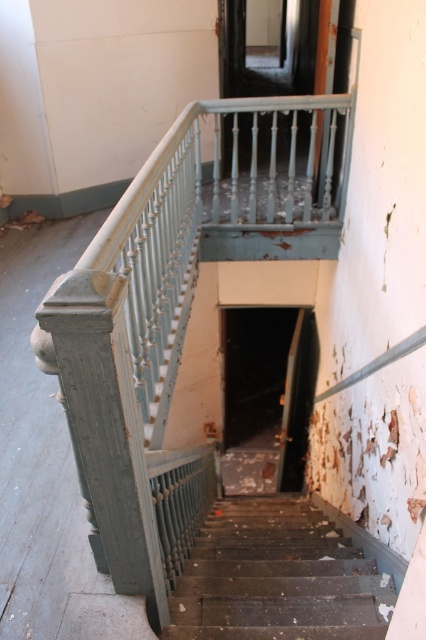
You are standing at the bottom of the staircase in the image. You notice a point marked at coordinates [178,310]. Which object in the scene does this point most likely indicate?

The point at coordinates [178,310] corresponds to the matte gray railing at upper center.

You are standing at the top of the staircase in the dimly lit area. You see two points marked on the wall. One is at point [285,196] and the other at point [262,572]. Which point is closer to you as you face down the staircase?

Point [262,572] is closer to you because it is in front of point [285,196] when facing down the staircase.